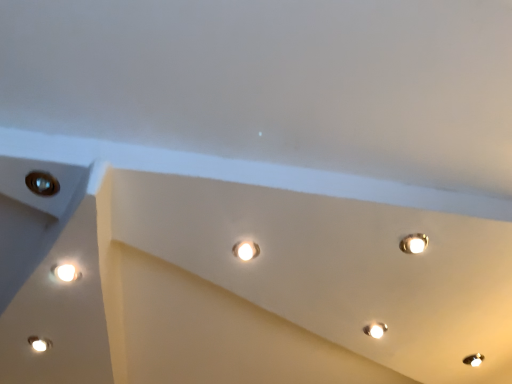
Question: Visually, is matte white lamp at lower left, acting as the 1th lamp starting from the front, positioned to the left or to the right of white glossy lamp at lower right, acting as the second lamp starting from the front?

Choices:
 (A) right
 (B) left

Answer: (B)

Question: Based on their sizes in the image, would you say matte white lamp at lower left, acting as the 1th lamp starting from the front, is bigger or smaller than white glossy lamp at lower right, the 1th lamp positioned from the back?

Choices:
 (A) small
 (B) big

Answer: (A)

Question: Which of these objects is positioned farthest from the matte white droplight at center?

Choices:
 (A) matte white lamp at lower left, acting as the 1th lamp starting from the front
 (B) white glossy lamp at lower right, the 2th lamp from the left
 (C) metallic circular hole at upper left

Answer: (A)

Question: Which object is positioned closest to the white glossy lamp at lower right, the 2th lamp from the left?

Choices:
 (A) matte white droplight at center
 (B) metallic circular hole at upper left
 (C) matte white lamp at lower left, which is counted as the first lamp, starting from the left

Answer: (A)